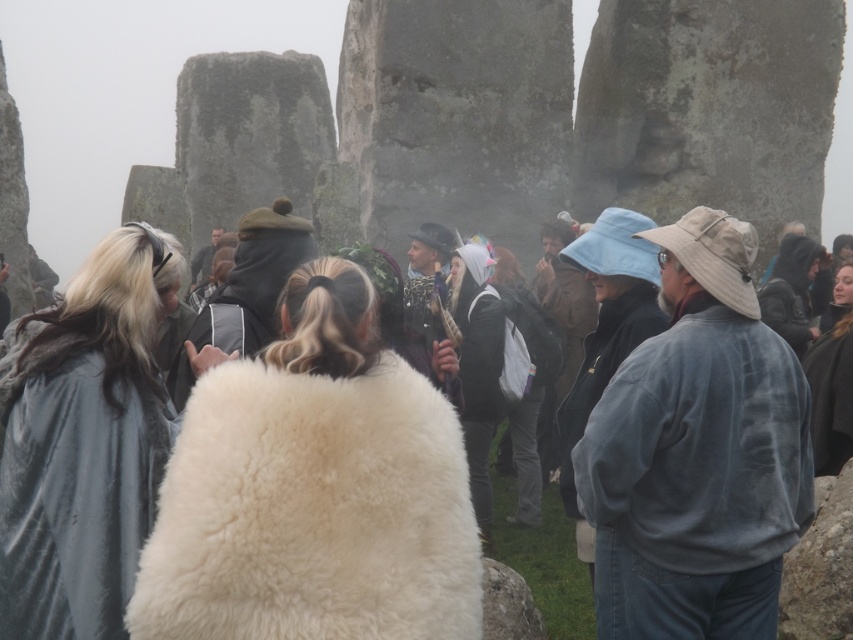
Image resolution: width=853 pixels, height=640 pixels. Describe the element at coordinates (697, 452) in the screenshot. I see `denim jacket at center` at that location.

Is denim jacket at center smaller than velvet gray cloak at left?

No.

Which is behind, point (740, 572) or point (47, 372)?

Point (740, 572)

The image size is (853, 640). Identify the location of denim jacket at center. (697, 452).

This screenshot has height=640, width=853. In order to click on denim jacket at center in this screenshot , I will do `click(697, 452)`.

Is denim jacket at center further to the viewer compared to light blue fabric hat at center?

No, it is not.

The width and height of the screenshot is (853, 640). I want to click on denim jacket at center, so click(697, 452).

This screenshot has height=640, width=853. I want to click on denim jacket at center, so click(x=697, y=452).

Can you confirm if velvet gray cloak at left is positioned to the left of white woolen coat at center?

Correct, you'll find velvet gray cloak at left to the left of white woolen coat at center.

Between velvet gray cloak at left and white woolen coat at center, which one has less height?

velvet gray cloak at left is shorter.

Find the location of `velvet gray cloak at left`. velvet gray cloak at left is located at coordinates (83, 442).